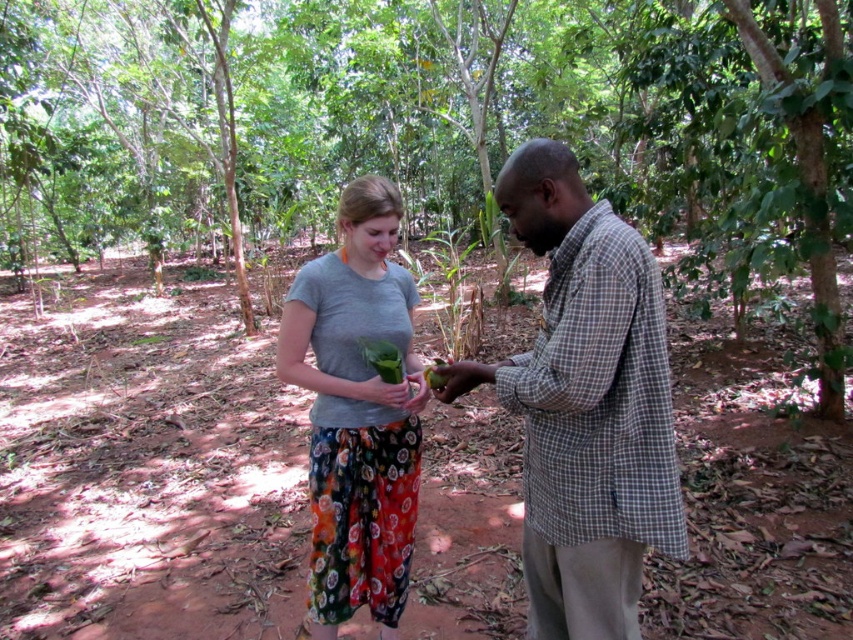
Question: Is green leafy tree at center thinner than green leafy vegetable at center?

Choices:
 (A) yes
 (B) no

Answer: (B)

Question: Which of the following is the closest to the observer?

Choices:
 (A) (573, 104)
 (B) (576, 496)
 (C) (312, 312)

Answer: (B)

Question: Estimate the real-world distances between objects in this image. Which object is farther from the green leafy tree at center?

Choices:
 (A) green leafy vegetable at center
 (B) gray checkered shirt at center
 (C) gray cotton t-shirt at center

Answer: (A)

Question: Is green leafy tree at center bigger than green leafy vegetable at center?

Choices:
 (A) yes
 (B) no

Answer: (A)

Question: Based on their relative distances, which object is farther from the gray cotton t-shirt at center?

Choices:
 (A) green leafy vegetable at center
 (B) gray checkered shirt at center
 (C) green leafy tree at center

Answer: (C)

Question: Does gray checkered shirt at center lie in front of green leafy vegetable at center?

Choices:
 (A) no
 (B) yes

Answer: (B)